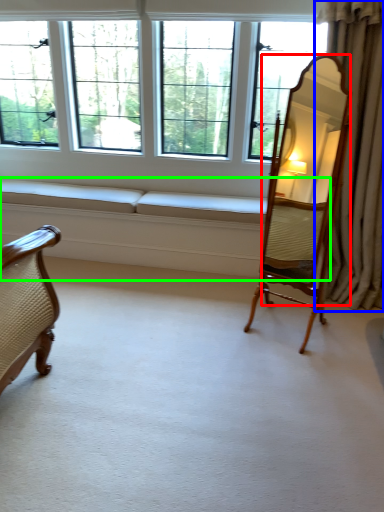
Question: Based on their relative distances, which object is farther from mirror (highlighted by a red box)? Choose from curtain (highlighted by a blue box) and couch (highlighted by a green box).

Choices:
 (A) curtain
 (B) couch

Answer: (B)